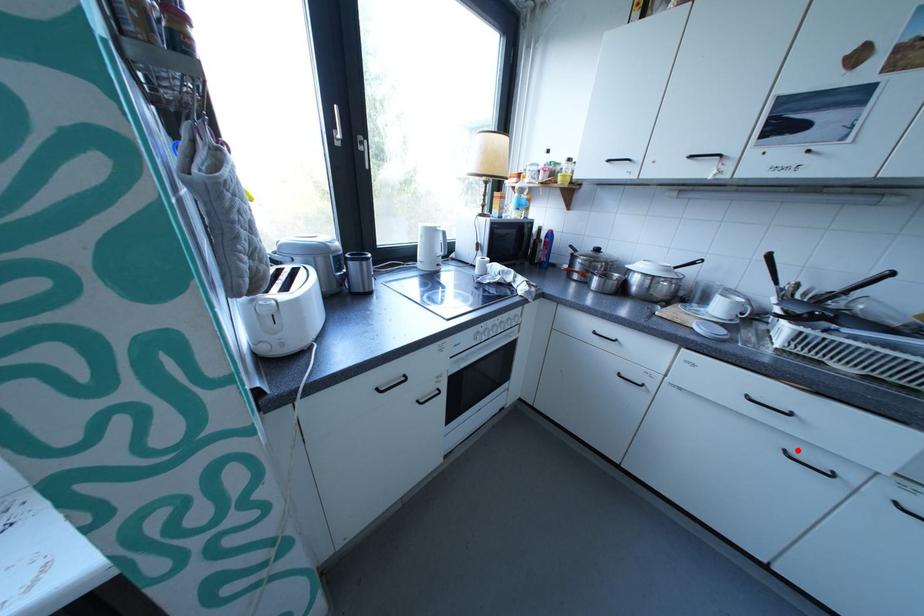
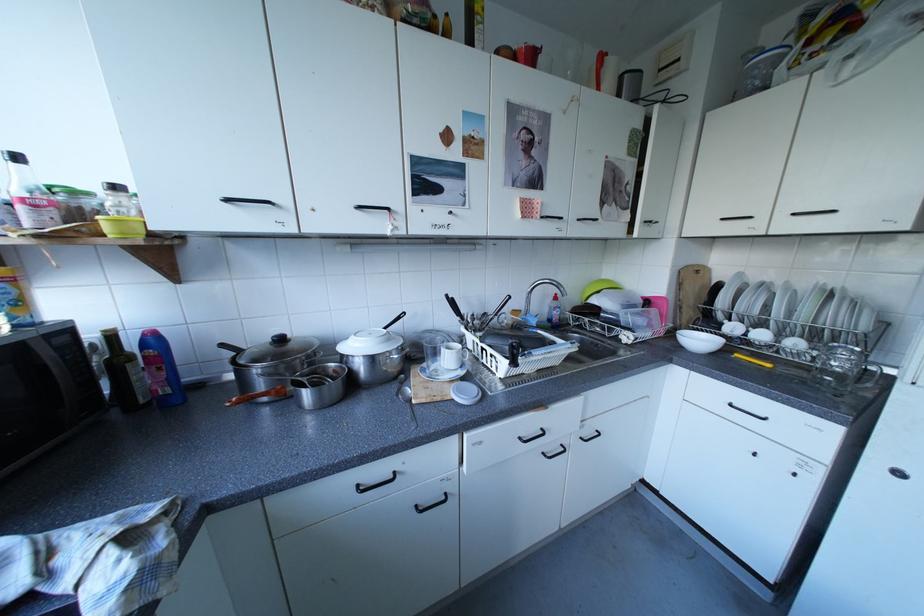
Question: I am providing you with two images of the same scene from different viewpoints. Given a red point in image1, look at the same physical point in image2. Is it:

Choices:
 (A) Closer to the viewpoint
 (B) Farther from the viewpoint

Answer: (B)